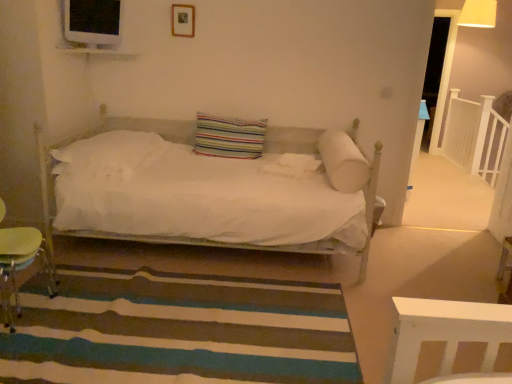
Question: Is striped fabric pillow at center, acting as the second pillow starting from the right, positioned behind wooden lampshade at upper right?

Choices:
 (A) no
 (B) yes

Answer: (A)

Question: Does striped fabric pillow at center, placed as the 2th pillow when sorted from left to right, have a greater width compared to wooden lampshade at upper right?

Choices:
 (A) no
 (B) yes

Answer: (A)

Question: Would you consider striped fabric pillow at center, acting as the second pillow starting from the right, to be distant from wooden lampshade at upper right?

Choices:
 (A) yes
 (B) no

Answer: (A)

Question: From a real-world perspective, is striped fabric pillow at center, acting as the second pillow starting from the right, over wooden lampshade at upper right?

Choices:
 (A) no
 (B) yes

Answer: (A)

Question: Can you confirm if striped fabric pillow at center, acting as the second pillow starting from the right, is bigger than wooden lampshade at upper right?

Choices:
 (A) no
 (B) yes

Answer: (A)

Question: In terms of width, does wooden picture frame at upper center look wider or thinner when compared to white soft pillow at center, acting as the 3th pillow starting from the right?

Choices:
 (A) thin
 (B) wide

Answer: (A)

Question: From their relative heights in the image, would you say wooden picture frame at upper center is taller or shorter than white soft pillow at center, positioned as the first pillow in left-to-right order?

Choices:
 (A) short
 (B) tall

Answer: (B)

Question: From a real-world perspective, is wooden picture frame at upper center positioned above or below white soft pillow at center, positioned as the first pillow in left-to-right order?

Choices:
 (A) below
 (B) above

Answer: (B)

Question: From the image's perspective, relative to white soft pillow at center, acting as the 3th pillow starting from the right, is wooden picture frame at upper center above or below?

Choices:
 (A) above
 (B) below

Answer: (A)

Question: Is wooden picture frame at upper center bigger or smaller than striped carpet at lower center?

Choices:
 (A) small
 (B) big

Answer: (A)

Question: Which is correct: wooden picture frame at upper center is inside striped carpet at lower center, or outside of it?

Choices:
 (A) outside
 (B) inside

Answer: (A)

Question: From the image's perspective, is wooden picture frame at upper center located above or below striped carpet at lower center?

Choices:
 (A) below
 (B) above

Answer: (B)

Question: From a real-world perspective, is wooden picture frame at upper center above or below striped carpet at lower center?

Choices:
 (A) above
 (B) below

Answer: (A)

Question: Considering the positions of white wooden balustrade at upper right and wooden lampshade at upper right in the image, is white wooden balustrade at upper right bigger or smaller than wooden lampshade at upper right?

Choices:
 (A) big
 (B) small

Answer: (A)

Question: Is white wooden balustrade at upper right inside the boundaries of wooden lampshade at upper right, or outside?

Choices:
 (A) inside
 (B) outside

Answer: (B)